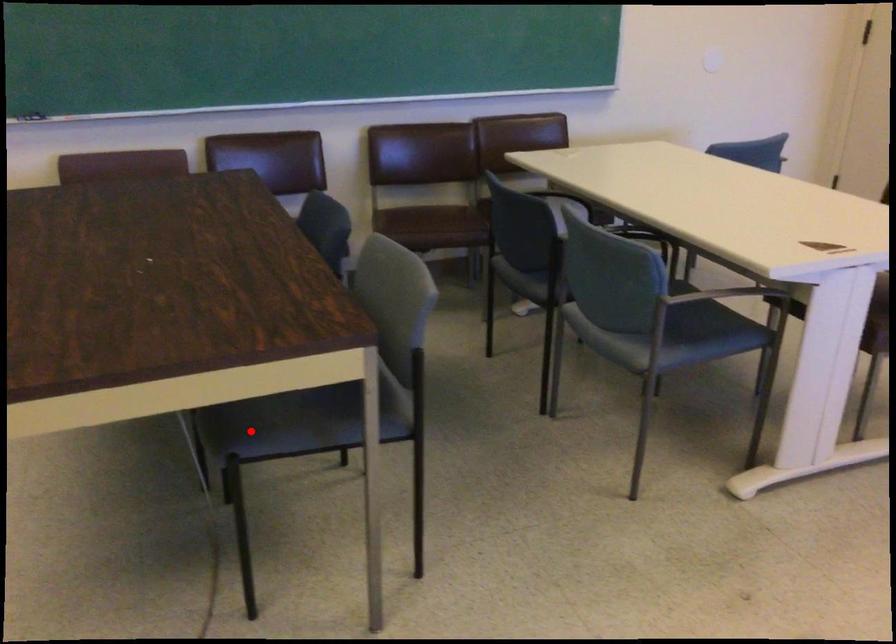
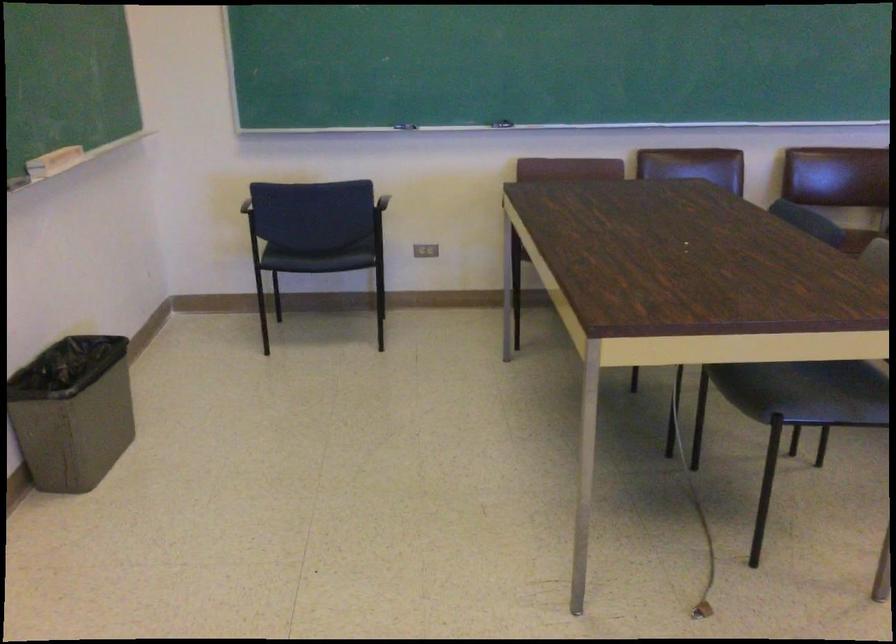
Find the pixel in the second image that matches the highlighted location in the first image.

(765, 391)